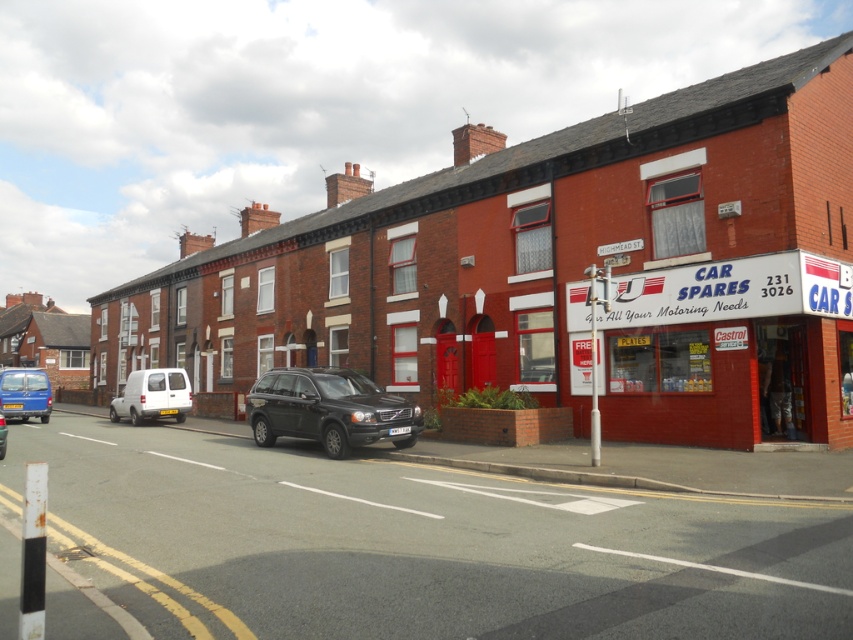
Question: Observing the image, what is the correct spatial positioning of shiny black suv at center in reference to white matte van at center?

Choices:
 (A) above
 (B) below

Answer: (A)

Question: Which point appears closest to the camera in this image?

Choices:
 (A) (250, 396)
 (B) (712, 289)

Answer: (B)

Question: Which point is farther to the camera?

Choices:
 (A) white matte van at center
 (B) red brick car spares shop at right

Answer: (A)

Question: Can you confirm if red brick car spares shop at right is wider than matte black suv at center?

Choices:
 (A) yes
 (B) no

Answer: (B)

Question: Which point is farther from the camera taking this photo?

Choices:
 (A) (289, 422)
 (B) (0, 456)

Answer: (A)

Question: Does red brick car spares shop at right have a lesser width compared to matte black suv at center?

Choices:
 (A) no
 (B) yes

Answer: (B)